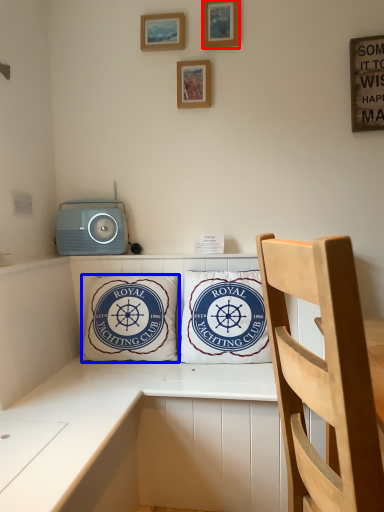
Question: Which point is closer to the camera, picture frame (highlighted by a red box) or pillow (highlighted by a blue box)?

Choices:
 (A) picture frame
 (B) pillow

Answer: (B)